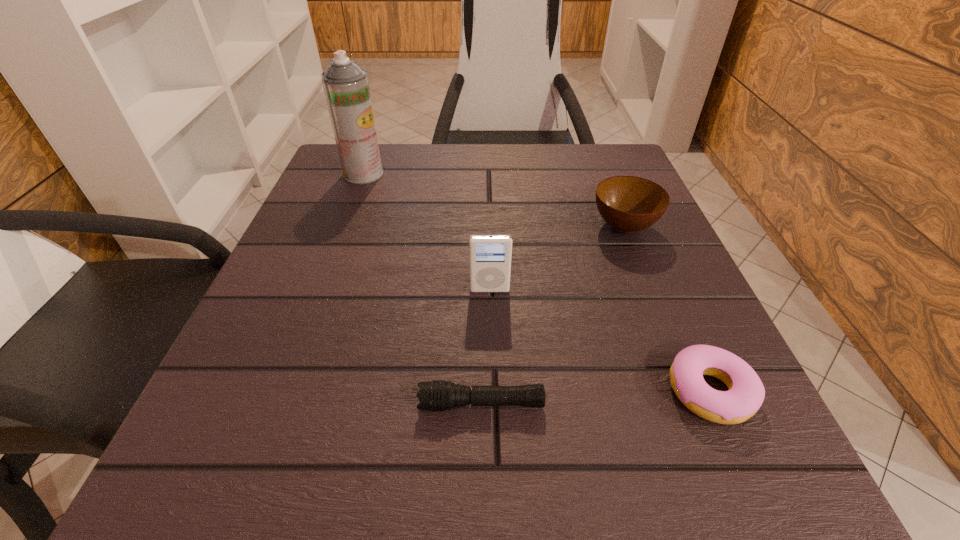
Find the location of `vacant region between the third shortest object and the farthest object`. vacant region between the third shortest object and the farthest object is located at coordinates (493, 200).

The height and width of the screenshot is (540, 960). Find the location of `vacant area between the farthest object and the bowl`. vacant area between the farthest object and the bowl is located at coordinates (493, 200).

This screenshot has height=540, width=960. What are the coordinates of `vacant area that lies between the third shortest object and the iPod` in the screenshot? It's located at (557, 258).

You are a GUI agent. You are given a task and a screenshot of the screen. Output one action in this format:
    pyautogui.click(x=<x>, y=<y>)
    Task: Click on the free spot between the bowl and the leftmost object
    This screenshot has height=540, width=960.
    Given the screenshot: What is the action you would take?
    pyautogui.click(x=493, y=200)

Where is `free spot between the fourth shortest object and the doughnut`? The height and width of the screenshot is (540, 960). free spot between the fourth shortest object and the doughnut is located at coordinates (600, 341).

Identify the location of free space between the doughnut and the second farthest object. The image size is (960, 540). (667, 309).

At what (x,y) coordinates should I click in order to perform the action: click on object that stands as the third closest to the aerosol can. Please return your answer as a coordinate pair (x, y). This screenshot has height=540, width=960. Looking at the image, I should click on (437, 395).

Locate an element on the screen. object that stands as the closest to the bowl is located at coordinates (490, 256).

This screenshot has height=540, width=960. In order to click on blank area in the image that satisfies the following two spatial constraints: 1. on the front-facing side of the third farthest object; 2. on the right side of the doughnut in this screenshot , I will do `click(492, 391)`.

Image resolution: width=960 pixels, height=540 pixels. In order to click on free space that satisfies the following two spatial constraints: 1. on the front side of the doughnut; 2. at the lens end of the flashlight in this screenshot , I will do `click(715, 404)`.